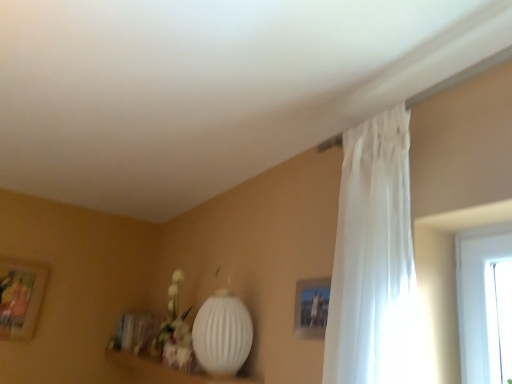
Where is `white ribbed lamp at lower center`? white ribbed lamp at lower center is located at coordinates 222,332.

Locate an element on the screen. The image size is (512, 384). white matte vase at lower center is located at coordinates (175, 317).

Which of these two, white sheer curtain at upper right or white ribbed lamp at lower center, stands shorter?

white ribbed lamp at lower center is shorter.

Is white sheer curtain at upper right facing towards white ribbed lamp at lower center?

No, white sheer curtain at upper right does not turn towards white ribbed lamp at lower center.

What's the angular difference between white sheer curtain at upper right and white ribbed lamp at lower center's facing directions?

There is a 0.00201-degree angle between the facing directions of white sheer curtain at upper right and white ribbed lamp at lower center.

There is a white ribbed lamp at lower center. What are the coordinates of `curtain above it (from a real-world perspective)` in the screenshot? It's located at (373, 258).

Which is correct: wooden picture frame at left is inside white sheer curtain at upper right, or outside of it?

wooden picture frame at left is not enclosed by white sheer curtain at upper right.

Does wooden picture frame at left lie behind white sheer curtain at upper right?

Yes, wooden picture frame at left is further from the camera.

Is wooden picture frame at left oriented away from white sheer curtain at upper right?

No, white sheer curtain at upper right is not at the back of wooden picture frame at left.

Can you tell me how much white matte vase at lower center and white sheer curtain at upper right differ in facing direction?

The angular difference between white matte vase at lower center and white sheer curtain at upper right is 0.000815 degrees.

From a real-world perspective, is white matte vase at lower center positioned above or below white sheer curtain at upper right?

Clearly, from a real-world perspective, white matte vase at lower center is below white sheer curtain at upper right.

Is white matte vase at lower center positioned with its back to white sheer curtain at upper right?

No, white matte vase at lower center's orientation is not away from white sheer curtain at upper right.

Is point (183, 345) behind point (408, 196)?

Yes, point (183, 345) is behind point (408, 196).

Which object is wider, white sheer curtain at upper right or white matte vase at lower center?

With larger width is white matte vase at lower center.

From the picture: From the image's perspective, would you say white sheer curtain at upper right is shown under white matte vase at lower center?

No.

Can you tell me how much white sheer curtain at upper right and white matte vase at lower center differ in facing direction?

The facing directions of white sheer curtain at upper right and white matte vase at lower center are 0.000815 degrees apart.

Considering the sizes of objects white sheer curtain at upper right and wooden picture frame at left in the image provided, who is wider, white sheer curtain at upper right or wooden picture frame at left?

white sheer curtain at upper right.

Measure the distance between white sheer curtain at upper right and wooden picture frame at left.

white sheer curtain at upper right and wooden picture frame at left are 2.72 meters apart.

From a real-world perspective, is white sheer curtain at upper right located higher than wooden picture frame at left?

Yes, from a real-world perspective, white sheer curtain at upper right is over wooden picture frame at left

Is white sheer curtain at upper right not inside wooden picture frame at left?

white sheer curtain at upper right is positioned outside wooden picture frame at left.

From a real-world perspective, between white ribbed lamp at lower center and white matte vase at lower center, who is vertically lower?

white ribbed lamp at lower center.

Relative to white matte vase at lower center, is white ribbed lamp at lower center in front or behind?

In the image, white ribbed lamp at lower center appears in front of white matte vase at lower center.

Where is `lamp lying in front of the white matte vase at lower center`? This screenshot has width=512, height=384. lamp lying in front of the white matte vase at lower center is located at coordinates (222, 332).

From the picture: Which of these two, white ribbed lamp at lower center or white matte vase at lower center, is bigger?

white ribbed lamp at lower center is bigger.

Does point (229, 298) come in front of point (4, 290)?

That is True.

Can you confirm if white ribbed lamp at lower center is positioned to the right of wooden picture frame at left?

Indeed, white ribbed lamp at lower center is positioned on the right side of wooden picture frame at left.

Is white ribbed lamp at lower center outside of wooden picture frame at left?

Indeed, white ribbed lamp at lower center is completely outside wooden picture frame at left.

From the image's perspective, would you say white ribbed lamp at lower center is shown under wooden picture frame at left?

Incorrect, from the image's perspective, white ribbed lamp at lower center is higher than wooden picture frame at left.

Locate an element on the screen. curtain located in front of the white ribbed lamp at lower center is located at coordinates (373, 258).

Where is `picture frame below the white sheer curtain at upper right (from the image's perspective)`? picture frame below the white sheer curtain at upper right (from the image's perspective) is located at coordinates (20, 296).

Based on their spatial positions, is white sheer curtain at upper right or white matte vase at lower center further from wooden picture frame at left?

white sheer curtain at upper right is further to wooden picture frame at left.

Considering their positions, is white matte vase at lower center positioned further to white sheer curtain at upper right than wooden picture frame at left?

Based on the image, wooden picture frame at left appears to be further to white sheer curtain at upper right.

Looking at the image, which one is located further to white matte vase at lower center, white sheer curtain at upper right or white ribbed lamp at lower center?

Among the two, white sheer curtain at upper right is located further to white matte vase at lower center.

Considering their positions, is white matte vase at lower center positioned further to white sheer curtain at upper right than white ribbed lamp at lower center?

white matte vase at lower center lies further to white sheer curtain at upper right than the other object.

Based on their spatial positions, is wooden picture frame at left or white matte vase at lower center further from white sheer curtain at upper right?

The object further to white sheer curtain at upper right is wooden picture frame at left.

Considering their positions, is white matte vase at lower center positioned closer to wooden picture frame at left than white sheer curtain at upper right?

Among the two, white matte vase at lower center is located nearer to wooden picture frame at left.

From the image, which object appears to be farther from white matte vase at lower center, wooden picture frame at left or white ribbed lamp at lower center?

wooden picture frame at left.

From the image, which object appears to be nearer to white ribbed lamp at lower center, white matte vase at lower center or wooden picture frame at left?

white matte vase at lower center is closer to white ribbed lamp at lower center.

In order to click on floral arrangement between wooden picture frame at left and white sheer curtain at upper right in the horizontal direction in this screenshot , I will do `click(175, 317)`.

Find the location of a particular element. lamp located between white sheer curtain at upper right and white matte vase at lower center in the depth direction is located at coordinates (222, 332).

This screenshot has width=512, height=384. I want to click on lamp between wooden picture frame at left and white sheer curtain at upper right from left to right, so click(222, 332).

Find the location of a particular element. floral arrangement between wooden picture frame at left and white ribbed lamp at lower center from left to right is located at coordinates (175, 317).